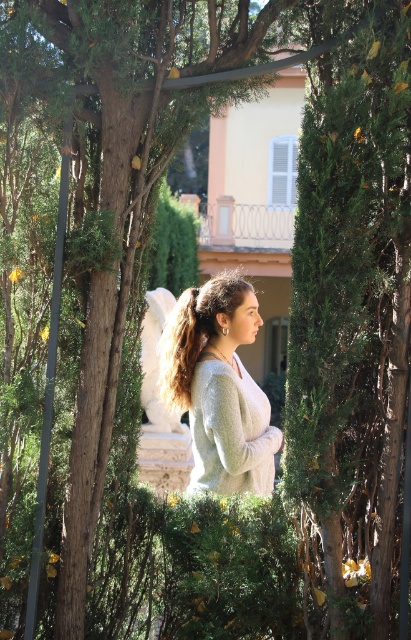
You are a fashion designer observing the woman in the serene outdoor scene. You notice two items of clothing on her, the light gray sweater at center and the light gray knitted sweater at center. Which one is taller?

The light gray sweater at center is much taller than the light gray knitted sweater at center.

You are standing in the outdoor scene and see the point at coordinates (x=219, y=387). Which object is this point located on?

The point at coordinates (x=219, y=387) is located on the light gray sweater at center.